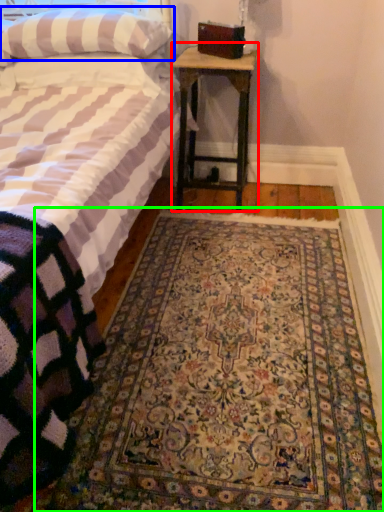
Question: Which is farther away from nightstand (highlighted by a red box)? pillow (highlighted by a blue box) or mat (highlighted by a green box)?

Choices:
 (A) pillow
 (B) mat

Answer: (B)